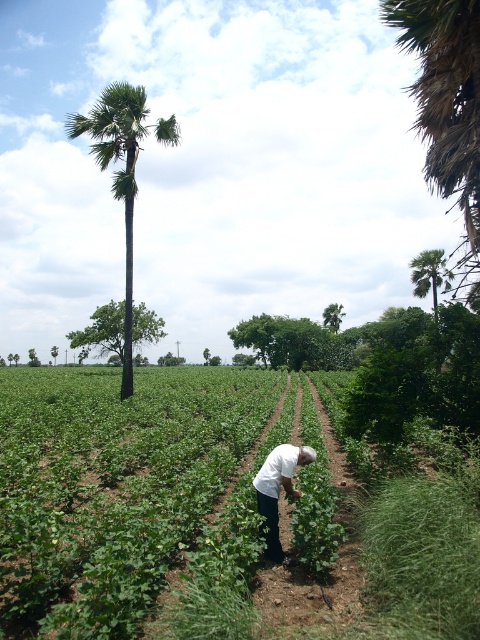
You are standing at the point labeled point (47, 516) and want to walk to the point labeled point (432, 275). Based on the scene description, will you be moving towards the background or the foreground?

You will be moving towards the background because point (47, 516) is in front of point (432, 275), so moving from the front to the back would head towards the background.

You are standing at the edge of the field and want to reach the green leafy palm tree at right without stepping on the green leafy plants at center. Which direction should you walk towards?

You should walk towards the right side of the image because the green leafy palm tree at right is located to the right of the green leafy plants at center, so you can avoid stepping on the plants by moving in that direction.

You are a farmer working in the field and want to plant a new tree. You have two options for locations based on the existing green leafy palm at left and green leafy palm tree at right. Which location would you choose if you want your new tree to grow taller, and why?

You should choose the location near the green leafy palm at left because it is larger in size than the green leafy palm tree at right, indicating better growth conditions there.